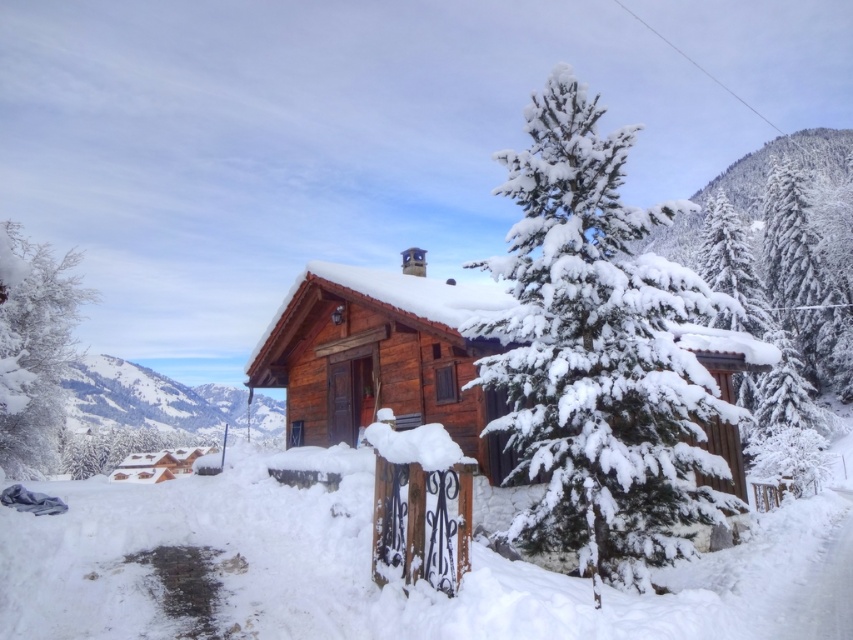
Which of these two, snow-covered evergreen at upper right or snowy wooden mountain at upper left, stands taller?

snowy wooden mountain at upper left

How much distance is there between snow-covered evergreen at upper right and snowy wooden mountain at upper left?

A distance of 99.71 meters exists between snow-covered evergreen at upper right and snowy wooden mountain at upper left.

In order to click on snow-covered evergreen at upper right in this screenshot , I will do `click(805, 282)`.

Who is positioned more to the left, white frosty tree at left or snowy wooden mountain at upper left?

snowy wooden mountain at upper left is more to the left.

Which is in front, point (86, 292) or point (280, 426)?

Point (86, 292)

This screenshot has height=640, width=853. What are the coordinates of `white frosty tree at left` in the screenshot? It's located at (33, 346).

You are a GUI agent. You are given a task and a screenshot of the screen. Output one action in this format:
    pyautogui.click(x=<x>, y=<y>)
    Task: Click on the white frosty tree at left
    
    Given the screenshot: What is the action you would take?
    pyautogui.click(x=33, y=346)

Can you confirm if white frosty tree at left is positioned above snow-covered evergreen at upper right?

No.

Which is in front, point (35, 285) or point (778, 182)?

Point (35, 285)

This screenshot has width=853, height=640. Find the location of `white frosty tree at left`. white frosty tree at left is located at coordinates (33, 346).